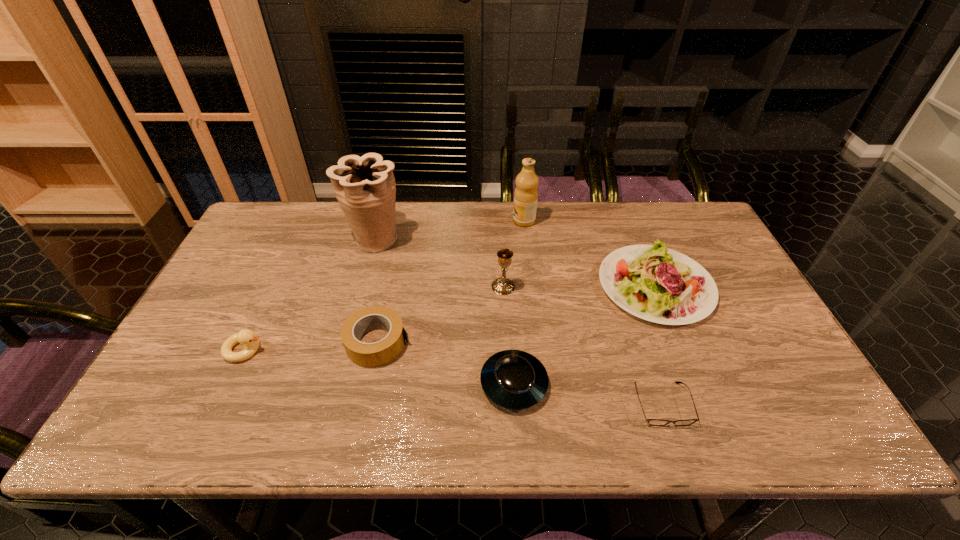
Identify the location of vacant space located 0.280m on the label of the olive oil. [430, 221].

You are a GUI agent. You are given a task and a screenshot of the screen. Output one action in this format:
    pyautogui.click(x=<x>, y=<y>)
    Task: Click on the vacant space situated 0.210m on the label of the olive oil
    The image size is (960, 540).
    Given the screenshot: What is the action you would take?
    coord(450,221)

Identify the location of vacant space located 0.070m on the back of the sixth shortest object. The width and height of the screenshot is (960, 540). (502, 262).

Locate an element on the screen. The height and width of the screenshot is (540, 960). free space located 0.180m on the back of the salad plate is located at coordinates (627, 215).

The height and width of the screenshot is (540, 960). Find the location of `free space located at the beak of the leftmost object`. free space located at the beak of the leftmost object is located at coordinates (308, 349).

The image size is (960, 540). I want to click on vacant area situated 0.140m at the edge of the duct tape, so click(x=464, y=343).

Image resolution: width=960 pixels, height=540 pixels. I want to click on vacant region located 0.160m on the right of the saucer, so click(615, 383).

At what (x,y) coordinates should I click in order to perform the action: click on urn at the far edge. Please return your answer as a coordinate pair (x, y). This screenshot has height=540, width=960. Looking at the image, I should click on (x=365, y=187).

Identify the location of olive oil present at the far edge. The width and height of the screenshot is (960, 540). (526, 193).

Find the location of `saucer located in the near edge section of the desktop`. saucer located in the near edge section of the desktop is located at coordinates [x=513, y=379].